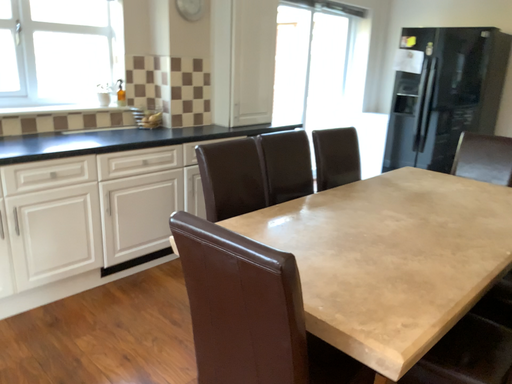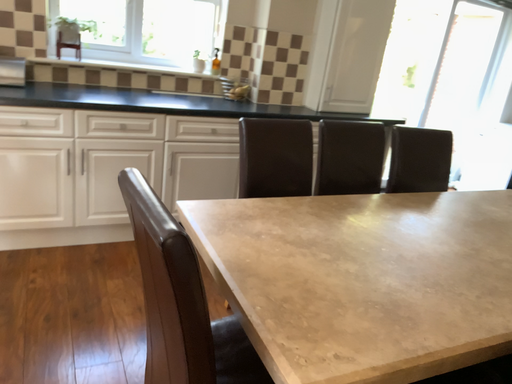
Question: How did the camera likely rotate when shooting the video?

Choices:
 (A) rotated right
 (B) rotated left

Answer: (B)